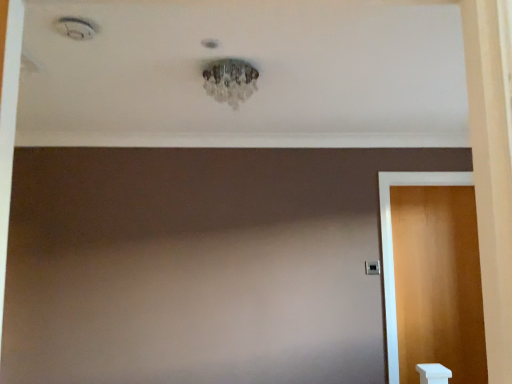
What do you see at coordinates (372, 268) in the screenshot? I see `black plastic door handle at right` at bounding box center [372, 268].

Find the location of `black plastic door handle at right`. black plastic door handle at right is located at coordinates (372, 268).

The width and height of the screenshot is (512, 384). I want to click on wooden door at right, so click(x=392, y=246).

The height and width of the screenshot is (384, 512). Describe the element at coordinates (392, 246) in the screenshot. I see `wooden door at right` at that location.

The height and width of the screenshot is (384, 512). What are the coordinates of `black plastic door handle at right` in the screenshot? It's located at (372, 268).

Based on the photo, considering the relative positions of wooden door at right and black plastic door handle at right in the image provided, is wooden door at right to the right of black plastic door handle at right from the viewer's perspective?

Yes, wooden door at right is to the right of black plastic door handle at right.

Which is in front, wooden door at right or black plastic door handle at right?

wooden door at right is in front.

Does point (387, 213) lie in front of point (376, 274)?

No, it is behind (376, 274).

Consider the image. From the image's perspective, is wooden door at right positioned above or below black plastic door handle at right?

From the image's perspective, wooden door at right appears below black plastic door handle at right.

In the scene shown: From a real-world perspective, is wooden door at right under black plastic door handle at right?

Yes.

In the scene shown: Can you confirm if wooden door at right is wider than black plastic door handle at right?

Yes.

Which of these two, wooden door at right or black plastic door handle at right, stands taller?

wooden door at right.

Considering the relative sizes of wooden door at right and black plastic door handle at right in the image provided, is wooden door at right smaller than black plastic door handle at right?

Actually, wooden door at right might be larger than black plastic door handle at right.

Could black plastic door handle at right be considered to be inside wooden door at right?

Definitely not — black plastic door handle at right is not inside wooden door at right.

Is wooden door at right positioned far away from black plastic door handle at right?

wooden door at right is near black plastic door handle at right, not far away.

Could you tell me if wooden door at right is turned towards black plastic door handle at right?

No, wooden door at right is not aimed at black plastic door handle at right.

How many degrees apart are the facing directions of wooden door at right and black plastic door handle at right?

They differ by 0.26 degrees in their facing directions.

Locate an element on the screen. The image size is (512, 384). door handle located above the wooden door at right (from a real-world perspective) is located at coordinates (372, 268).

Which is more to the right, black plastic door handle at right or wooden door at right?

Positioned to the right is wooden door at right.

Relative to wooden door at right, is black plastic door handle at right in front or behind?

In the image, black plastic door handle at right appears behind wooden door at right.

Considering the positions of point (369, 270) and point (379, 178), is point (369, 270) closer or farther from the camera than point (379, 178)?

Point (369, 270) is closer to the camera than point (379, 178).

Looking at this image, from the image's perspective, relative to wooden door at right, is black plastic door handle at right above or below?

Based on their image positions, black plastic door handle at right is located above wooden door at right.

From a real-world perspective, between black plastic door handle at right and wooden door at right, who is vertically lower?

From a 3D spatial view, wooden door at right is below.

Considering the sizes of objects black plastic door handle at right and wooden door at right in the image provided, who is thinner, black plastic door handle at right or wooden door at right?

black plastic door handle at right is thinner.

Can you confirm if black plastic door handle at right is shorter than wooden door at right?

Yes, black plastic door handle at right is shorter than wooden door at right.

Who is smaller, black plastic door handle at right or wooden door at right?

With smaller size is black plastic door handle at right.

Is black plastic door handle at right completely or partially outside of wooden door at right?

Yes, black plastic door handle at right is outside of wooden door at right.

Consider the image. Is black plastic door handle at right with wooden door at right?

No, black plastic door handle at right is not next to wooden door at right.

Could you tell me if black plastic door handle at right is facing wooden door at right?

No.

The width and height of the screenshot is (512, 384). What are the coordinates of `door handle behind the wooden door at right` in the screenshot? It's located at (372, 268).

In the image, there is a wooden door at right. Where is `door handle above it (from the image's perspective)`? This screenshot has height=384, width=512. door handle above it (from the image's perspective) is located at coordinates (372, 268).

I want to click on door below the black plastic door handle at right (from the image's perspective), so click(x=392, y=246).